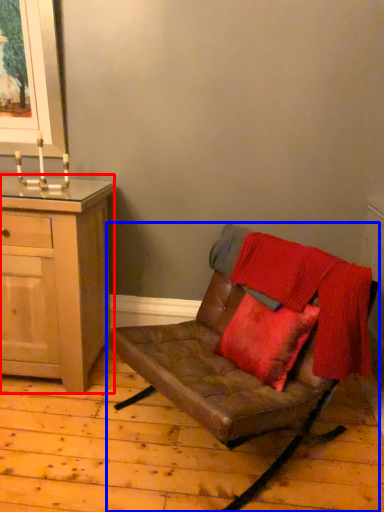
Question: Which of the following is the farthest to the observer, cabinetry (highlighted by a red box) or chair (highlighted by a blue box)?

Choices:
 (A) cabinetry
 (B) chair

Answer: (A)